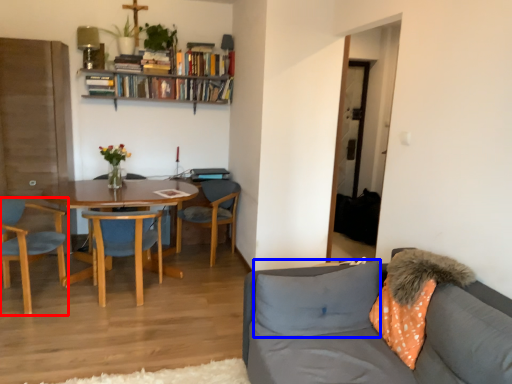
Question: Which object appears closest to the camera in this image, chair (highlighted by a red box) or pillow (highlighted by a blue box)?

Choices:
 (A) chair
 (B) pillow

Answer: (B)